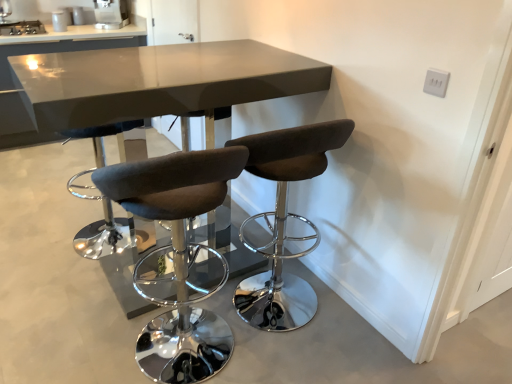
Question: Is brown fabric stool at center, marked as the 1th chair in a right-to-left arrangement, outside of dark gray fabric stool at center, arranged as the 1th chair when viewed from the left?

Choices:
 (A) yes
 (B) no

Answer: (A)

Question: Is brown fabric stool at center, the second chair in the left-to-right sequence, far away from dark gray fabric stool at center, which is counted as the 2th chair, starting from the right?

Choices:
 (A) no
 (B) yes

Answer: (A)

Question: Could you tell me if brown fabric stool at center, marked as the 1th chair in a right-to-left arrangement, is turned towards dark gray fabric stool at center, arranged as the 1th chair when viewed from the left?

Choices:
 (A) yes
 (B) no

Answer: (B)

Question: Does brown fabric stool at center, marked as the 1th chair in a right-to-left arrangement, appear on the right side of dark gray fabric stool at center, which is counted as the 2th chair, starting from the right?

Choices:
 (A) no
 (B) yes

Answer: (B)

Question: Considering the relative sizes of brown fabric stool at center, the second chair in the left-to-right sequence, and dark gray fabric stool at center, arranged as the 1th chair when viewed from the left, in the image provided, is brown fabric stool at center, the second chair in the left-to-right sequence, smaller than dark gray fabric stool at center, arranged as the 1th chair when viewed from the left,?

Choices:
 (A) no
 (B) yes

Answer: (B)

Question: In terms of width, does satin silver coffee machine at upper center, which is the 2th appliance in bottom-to-top order, look wider or thinner when compared to glossy gray table at upper center, which is the 1th table from left to right?

Choices:
 (A) thin
 (B) wide

Answer: (A)

Question: Is point (104, 28) positioned closer to the camera than point (19, 43)?

Choices:
 (A) closer
 (B) farther

Answer: (B)

Question: From their relative heights in the image, would you say satin silver coffee machine at upper center, which is the 2th appliance in bottom-to-top order, is taller or shorter than glossy gray table at upper center, which is counted as the 1th table, starting from the back?

Choices:
 (A) tall
 (B) short

Answer: (B)

Question: Is satin silver coffee machine at upper center, placed as the second appliance when sorted from left to right, in front of or behind glossy gray table at upper center, which is the 1th table from left to right, in the image?

Choices:
 (A) behind
 (B) front

Answer: (A)

Question: Is dark gray fabric stool at center, which is counted as the 2th chair, starting from the right, taller or shorter than matte gray table at center, the 2th table viewed from the left?

Choices:
 (A) tall
 (B) short

Answer: (B)

Question: From the image's perspective, is dark gray fabric stool at center, which is counted as the 2th chair, starting from the right, positioned above or below matte gray table at center, which is the first table from front to back?

Choices:
 (A) above
 (B) below

Answer: (B)

Question: Is dark gray fabric stool at center, which is counted as the 2th chair, starting from the right, spatially inside matte gray table at center, the first table from the right, or outside of it?

Choices:
 (A) inside
 (B) outside

Answer: (B)

Question: From a real-world perspective, relative to matte gray table at center, which is counted as the second table, starting from the back, is dark gray fabric stool at center, arranged as the 1th chair when viewed from the left, vertically above or below?

Choices:
 (A) below
 (B) above

Answer: (A)

Question: Is satin silver coffee machine at upper center, placed as the second appliance when sorted from left to right, wider or thinner than stainless steel stove at upper left, acting as the 2th appliance starting from the top?

Choices:
 (A) wide
 (B) thin

Answer: (B)

Question: Considering their positions, is satin silver coffee machine at upper center, positioned as the first appliance in top-to-bottom order, located in front of or behind stainless steel stove at upper left, the 2th appliance when ordered from right to left?

Choices:
 (A) front
 (B) behind

Answer: (B)